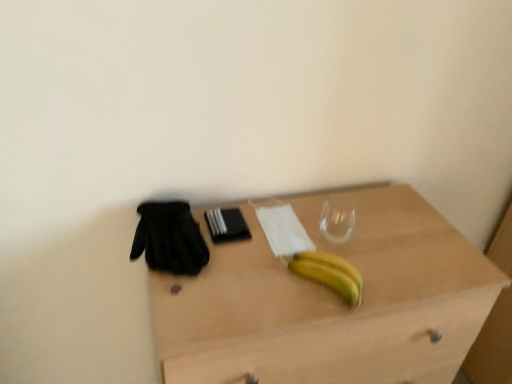
This screenshot has width=512, height=384. I want to click on empty space that is ontop of light wood desk at center, so click(316, 242).